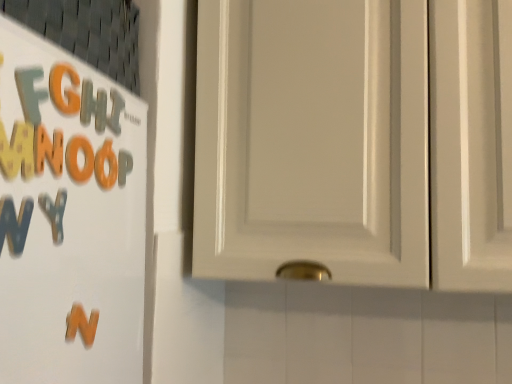
Question: Is orange foam letter at left, which appears as the 1th letter when viewed from the front, inside or outside of matte white cabinet at upper right?

Choices:
 (A) inside
 (B) outside

Answer: (B)

Question: Is orange foam letter at left, placed as the 6th letter when sorted from back to front, taller or shorter than matte white cabinet at upper right?

Choices:
 (A) tall
 (B) short

Answer: (B)

Question: Considering the real-world distances, which object is closest to the orange matte letter n at left?

Choices:
 (A) orange foam letter at left, placed as the 6th letter when sorted from back to front
 (B) matte white cabinet at upper right
 (C) orange matte letter at upper left, which is the 4th letter in front-to-back order
 (D) matte plastic letter at upper left, which ranks as the fifth letter in front-to-back order
 (E) orange foam letter at upper left, the 3th letter when ordered from front to back

Answer: (E)

Question: Which object is positioned farthest from the orange matte letter n at left?

Choices:
 (A) matte orange letter g at upper left, the second letter in the front-to-back sequence
 (B) matte white cabinet at upper right
 (C) orange foam letter at left, placed as the 6th letter when sorted from back to front
 (D) orange foam letter at upper left, the 4th letter when ordered from back to front
 (E) orange matte letter at upper left, placed as the third letter when sorted from back to front

Answer: (B)